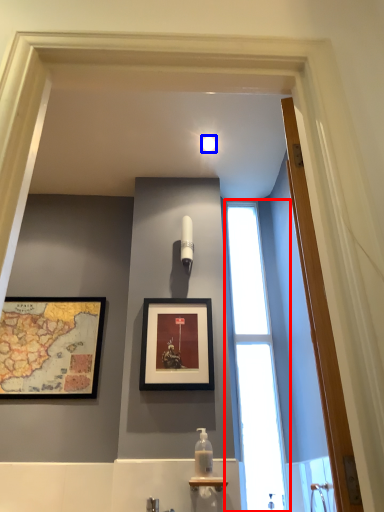
Question: Which of the following is the farthest to the observer, window (highlighted by a red box) or light fixture (highlighted by a blue box)?

Choices:
 (A) window
 (B) light fixture

Answer: (B)